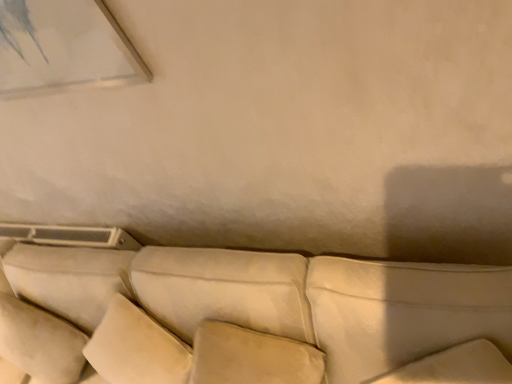
How much space does suede-like beige pillow at center, the 2th pillow when ordered from right to left, occupy horizontally?

It is 6.61 inches.

The width and height of the screenshot is (512, 384). What do you see at coordinates (69, 279) in the screenshot?
I see `beige suede pillow at lower left, marked as the 3th pillow in a right-to-left arrangement` at bounding box center [69, 279].

This screenshot has width=512, height=384. In order to click on white leather pillow at lower right, which ranks as the first pillow in right-to-left order in this screenshot , I will do `click(403, 312)`.

Consider the image. How different are the orientations of suede-like beige pillow at center, the 2th pillow when ordered from right to left, and white leather pillow at lower right, which is counted as the 3th pillow, starting from the left, in degrees?

The angular difference between suede-like beige pillow at center, the 2th pillow when ordered from right to left, and white leather pillow at lower right, which is counted as the 3th pillow, starting from the left, is 2.53 degrees.

From the picture: Considering the sizes of suede-like beige pillow at center, the 2th pillow when ordered from right to left, and white leather pillow at lower right, which is counted as the 3th pillow, starting from the left, in the image, is suede-like beige pillow at center, the 2th pillow when ordered from right to left, taller or shorter than white leather pillow at lower right, which is counted as the 3th pillow, starting from the left,?

Considering their sizes, suede-like beige pillow at center, the 2th pillow when ordered from right to left, has more height than white leather pillow at lower right, which is counted as the 3th pillow, starting from the left.

How far apart are suede-like beige pillow at center, the second pillow in the left-to-right sequence, and white leather pillow at lower right, which ranks as the first pillow in right-to-left order?

A distance of 24.93 centimeters exists between suede-like beige pillow at center, the second pillow in the left-to-right sequence, and white leather pillow at lower right, which ranks as the first pillow in right-to-left order.

From a real-world perspective, which object stands above the other?

white leather pillow at lower right, which ranks as the first pillow in right-to-left order, is physically above.

Is beige suede pillow at lower left, acting as the 1th pillow starting from the left, smaller than suede-like beige couch at center?

Indeed, beige suede pillow at lower left, acting as the 1th pillow starting from the left, has a smaller size compared to suede-like beige couch at center.

From the image's perspective, is beige suede pillow at lower left, acting as the 1th pillow starting from the left, above or below suede-like beige couch at center?

beige suede pillow at lower left, acting as the 1th pillow starting from the left, is below suede-like beige couch at center.

What's the angular difference between beige suede pillow at lower left, marked as the 3th pillow in a right-to-left arrangement, and suede-like beige couch at center's facing directions?

6.84 degrees separate the facing orientations of beige suede pillow at lower left, marked as the 3th pillow in a right-to-left arrangement, and suede-like beige couch at center.

Where is `studio couch that is under the beige suede pillow at lower left, marked as the 3th pillow in a right-to-left arrangement (from a real-world perspective)`? This screenshot has width=512, height=384. studio couch that is under the beige suede pillow at lower left, marked as the 3th pillow in a right-to-left arrangement (from a real-world perspective) is located at coordinates (251, 317).

Is suede-like beige couch at center to the left or to the right of white leather pillow at lower right, which ranks as the first pillow in right-to-left order, in the image?

suede-like beige couch at center is to the left of white leather pillow at lower right, which ranks as the first pillow in right-to-left order.

Considering the sizes of suede-like beige couch at center and white leather pillow at lower right, which is counted as the 3th pillow, starting from the left, in the image, is suede-like beige couch at center taller or shorter than white leather pillow at lower right, which is counted as the 3th pillow, starting from the left,?

Considering their sizes, suede-like beige couch at center has more height than white leather pillow at lower right, which is counted as the 3th pillow, starting from the left.

Is suede-like beige couch at center bigger than white leather pillow at lower right, which is counted as the 3th pillow, starting from the left?

Yes, suede-like beige couch at center is bigger than white leather pillow at lower right, which is counted as the 3th pillow, starting from the left.

Considering the sizes of objects suede-like beige couch at center and white leather pillow at lower right, which ranks as the first pillow in right-to-left order, in the image provided, who is thinner, suede-like beige couch at center or white leather pillow at lower right, which ranks as the first pillow in right-to-left order,?

white leather pillow at lower right, which ranks as the first pillow in right-to-left order, is thinner.

Based on their sizes in the image, would you say suede-like beige couch at center is bigger or smaller than beige suede pillow at lower left, acting as the 1th pillow starting from the left?

suede-like beige couch at center is bigger than beige suede pillow at lower left, acting as the 1th pillow starting from the left.

Which is behind, point (82, 277) or point (59, 267)?

The point (59, 267) is farther.

Does suede-like beige couch at center appear on the right side of beige suede pillow at lower left, acting as the 1th pillow starting from the left?

Yes, suede-like beige couch at center is to the right of beige suede pillow at lower left, acting as the 1th pillow starting from the left.

From the image's perspective, between suede-like beige couch at center and beige suede pillow at lower left, acting as the 1th pillow starting from the left, who is located below?

beige suede pillow at lower left, acting as the 1th pillow starting from the left, appears lower in the image.

From the picture: Is suede-like beige pillow at center, the second pillow in the left-to-right sequence, oriented away from suede-like beige couch at center?

That's right, suede-like beige pillow at center, the second pillow in the left-to-right sequence, is facing away from suede-like beige couch at center.

Considering the sizes of objects suede-like beige pillow at center, the 2th pillow when ordered from right to left, and suede-like beige couch at center in the image provided, who is bigger, suede-like beige pillow at center, the 2th pillow when ordered from right to left, or suede-like beige couch at center?

suede-like beige couch at center is bigger.

Can you tell me how much suede-like beige pillow at center, the second pillow in the left-to-right sequence, and suede-like beige couch at center differ in facing direction?

The angle between the facing direction of suede-like beige pillow at center, the second pillow in the left-to-right sequence, and the facing direction of suede-like beige couch at center is 2.05 degrees.

Considering the relative positions of suede-like beige pillow at center, the second pillow in the left-to-right sequence, and suede-like beige couch at center in the image provided, is suede-like beige pillow at center, the second pillow in the left-to-right sequence, to the right of suede-like beige couch at center from the viewer's perspective?

Indeed, suede-like beige pillow at center, the second pillow in the left-to-right sequence, is positioned on the right side of suede-like beige couch at center.

Considering the positions of points (453, 265) and (228, 382), is point (453, 265) closer to camera compared to point (228, 382)?

Yes, point (453, 265) is in front of point (228, 382).

Considering the relative positions of white leather pillow at lower right, which is counted as the 3th pillow, starting from the left, and suede-like beige pillow at center, the second pillow in the left-to-right sequence, in the image provided, is white leather pillow at lower right, which is counted as the 3th pillow, starting from the left, to the right of suede-like beige pillow at center, the second pillow in the left-to-right sequence, from the viewer's perspective?

Indeed, white leather pillow at lower right, which is counted as the 3th pillow, starting from the left, is positioned on the right side of suede-like beige pillow at center, the second pillow in the left-to-right sequence.

Which of these two, white leather pillow at lower right, which ranks as the first pillow in right-to-left order, or suede-like beige pillow at center, the second pillow in the left-to-right sequence, is thinner?

With smaller width is suede-like beige pillow at center, the second pillow in the left-to-right sequence.

From a real-world perspective, does beige suede pillow at lower left, marked as the 3th pillow in a right-to-left arrangement, sit lower than white leather pillow at lower right, which ranks as the first pillow in right-to-left order?

Yes.

What's the angular difference between beige suede pillow at lower left, acting as the 1th pillow starting from the left, and white leather pillow at lower right, which ranks as the first pillow in right-to-left order,'s facing directions?

There is a 6.36-degree angle between the facing directions of beige suede pillow at lower left, acting as the 1th pillow starting from the left, and white leather pillow at lower right, which ranks as the first pillow in right-to-left order.

Would you say white leather pillow at lower right, which ranks as the first pillow in right-to-left order, is part of beige suede pillow at lower left, acting as the 1th pillow starting from the left,'s contents?

Actually, white leather pillow at lower right, which ranks as the first pillow in right-to-left order, is outside beige suede pillow at lower left, acting as the 1th pillow starting from the left.

Considering the relative sizes of beige suede pillow at lower left, acting as the 1th pillow starting from the left, and white leather pillow at lower right, which is counted as the 3th pillow, starting from the left, in the image provided, is beige suede pillow at lower left, acting as the 1th pillow starting from the left, wider than white leather pillow at lower right, which is counted as the 3th pillow, starting from the left,?

Yes.

In order to click on pillow that is the 1st one when counting leftward from the white leather pillow at lower right, which is counted as the 3th pillow, starting from the left in this screenshot , I will do `click(251, 357)`.

The height and width of the screenshot is (384, 512). I want to click on studio couch that appears in front of the beige suede pillow at lower left, acting as the 1th pillow starting from the left, so click(x=251, y=317).

Based on the photo, when comparing their distances from beige suede pillow at lower left, marked as the 3th pillow in a right-to-left arrangement, does white leather pillow at lower right, which ranks as the first pillow in right-to-left order, or suede-like beige pillow at center, the 2th pillow when ordered from right to left, seem closer?

suede-like beige pillow at center, the 2th pillow when ordered from right to left.

From the image, which object appears to be nearer to suede-like beige pillow at center, the 2th pillow when ordered from right to left, suede-like beige couch at center or white leather pillow at lower right, which ranks as the first pillow in right-to-left order?

suede-like beige couch at center.

Estimate the real-world distances between objects in this image. Which object is closer to white leather pillow at lower right, which ranks as the first pillow in right-to-left order, beige suede pillow at lower left, marked as the 3th pillow in a right-to-left arrangement, or suede-like beige couch at center?

suede-like beige couch at center is closer to white leather pillow at lower right, which ranks as the first pillow in right-to-left order.

When comparing their distances from suede-like beige pillow at center, the second pillow in the left-to-right sequence, does beige suede pillow at lower left, acting as the 1th pillow starting from the left, or suede-like beige couch at center seem closer?

suede-like beige couch at center.

Estimate the real-world distances between objects in this image. Which object is closer to beige suede pillow at lower left, marked as the 3th pillow in a right-to-left arrangement, suede-like beige pillow at center, the 2th pillow when ordered from right to left, or suede-like beige couch at center?

suede-like beige couch at center lies closer to beige suede pillow at lower left, marked as the 3th pillow in a right-to-left arrangement, than the other object.

From the image, which object appears to be nearer to suede-like beige pillow at center, the second pillow in the left-to-right sequence, beige suede pillow at lower left, marked as the 3th pillow in a right-to-left arrangement, or white leather pillow at lower right, which is counted as the 3th pillow, starting from the left?

white leather pillow at lower right, which is counted as the 3th pillow, starting from the left.

From the image, which object appears to be nearer to suede-like beige couch at center, white leather pillow at lower right, which ranks as the first pillow in right-to-left order, or beige suede pillow at lower left, acting as the 1th pillow starting from the left?

white leather pillow at lower right, which ranks as the first pillow in right-to-left order, lies closer to suede-like beige couch at center than the other object.

Which object lies nearer to the anchor point white leather pillow at lower right, which is counted as the 3th pillow, starting from the left, suede-like beige pillow at center, the 2th pillow when ordered from right to left, or suede-like beige couch at center?

suede-like beige couch at center is positioned closer to the anchor white leather pillow at lower right, which is counted as the 3th pillow, starting from the left.

Identify the location of studio couch situated between beige suede pillow at lower left, acting as the 1th pillow starting from the left, and suede-like beige pillow at center, the 2th pillow when ordered from right to left, from left to right. The width and height of the screenshot is (512, 384). (251, 317).

In order to click on studio couch situated between beige suede pillow at lower left, acting as the 1th pillow starting from the left, and white leather pillow at lower right, which ranks as the first pillow in right-to-left order, from left to right in this screenshot , I will do `click(251, 317)`.

Identify the location of pillow between beige suede pillow at lower left, marked as the 3th pillow in a right-to-left arrangement, and white leather pillow at lower right, which is counted as the 3th pillow, starting from the left. (251, 357).

You are a GUI agent. You are given a task and a screenshot of the screen. Output one action in this format:
    pyautogui.click(x=<x>, y=<y>)
    Task: Click on the pillow located between suede-like beige couch at center and white leather pillow at lower right, which is counted as the 3th pillow, starting from the left, in the left-right direction
    The width and height of the screenshot is (512, 384).
    Given the screenshot: What is the action you would take?
    pyautogui.click(x=251, y=357)